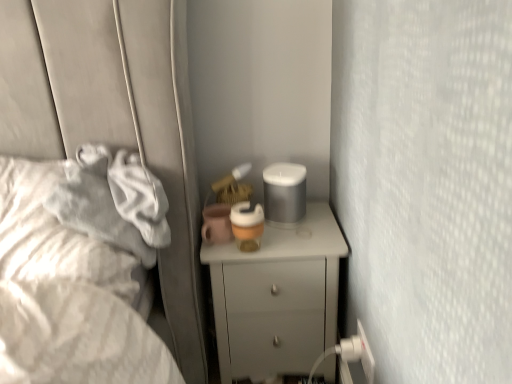
Question: Considering the relative sizes of white glossy chest of drawers at center and white plastic electric outlet at lower right in the image provided, is white glossy chest of drawers at center shorter than white plastic electric outlet at lower right?

Choices:
 (A) no
 (B) yes

Answer: (A)

Question: From a real-world perspective, is white glossy chest of drawers at center positioned over white plastic electric outlet at lower right based on gravity?

Choices:
 (A) no
 (B) yes

Answer: (A)

Question: Can you confirm if white glossy chest of drawers at center is positioned to the left of white plastic electric outlet at lower right?

Choices:
 (A) yes
 (B) no

Answer: (A)

Question: From a real-world perspective, is white glossy chest of drawers at center below white plastic electric outlet at lower right?

Choices:
 (A) yes
 (B) no

Answer: (A)

Question: Would you say white plastic electric outlet at lower right is part of white glossy chest of drawers at center's contents?

Choices:
 (A) no
 (B) yes

Answer: (A)

Question: Is white glossy chest of drawers at center outside of white plastic electric outlet at lower right?

Choices:
 (A) yes
 (B) no

Answer: (A)

Question: From the image's perspective, does white plastic electric outlet at lower right appear higher than white soft fabric at left?

Choices:
 (A) yes
 (B) no

Answer: (B)

Question: Is white plastic electric outlet at lower right positioned before white soft fabric at left?

Choices:
 (A) no
 (B) yes

Answer: (A)

Question: From a real-world perspective, is white plastic electric outlet at lower right positioned under white soft fabric at left based on gravity?

Choices:
 (A) no
 (B) yes

Answer: (B)

Question: Can you confirm if white plastic electric outlet at lower right is bigger than white soft fabric at left?

Choices:
 (A) no
 (B) yes

Answer: (A)

Question: Can you see white plastic electric outlet at lower right touching white soft fabric at left?

Choices:
 (A) no
 (B) yes

Answer: (A)

Question: Is white plastic electric outlet at lower right turned away from white soft fabric at left?

Choices:
 (A) yes
 (B) no

Answer: (B)

Question: Is white plastic electric outlet at lower right directly adjacent to white glossy chest of drawers at center?

Choices:
 (A) no
 (B) yes

Answer: (A)